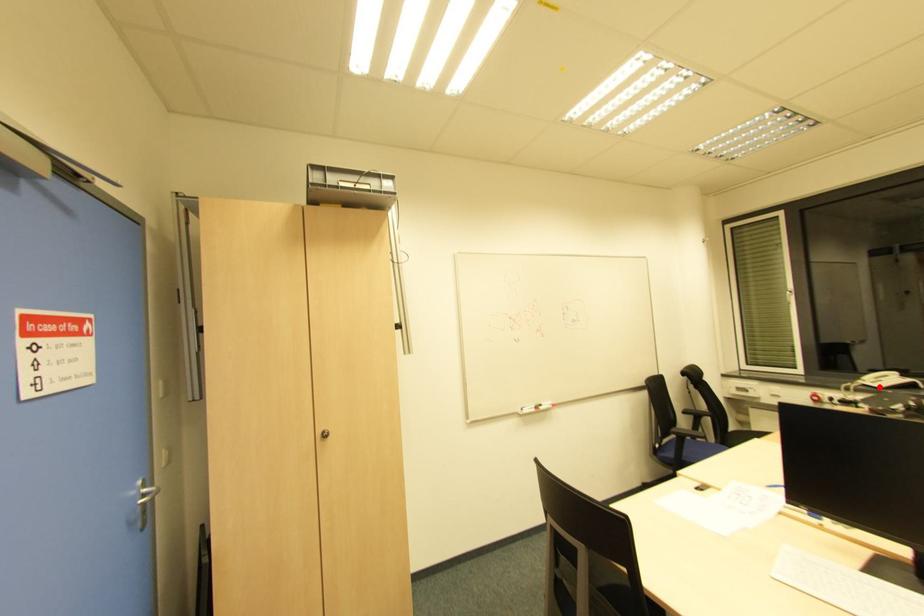
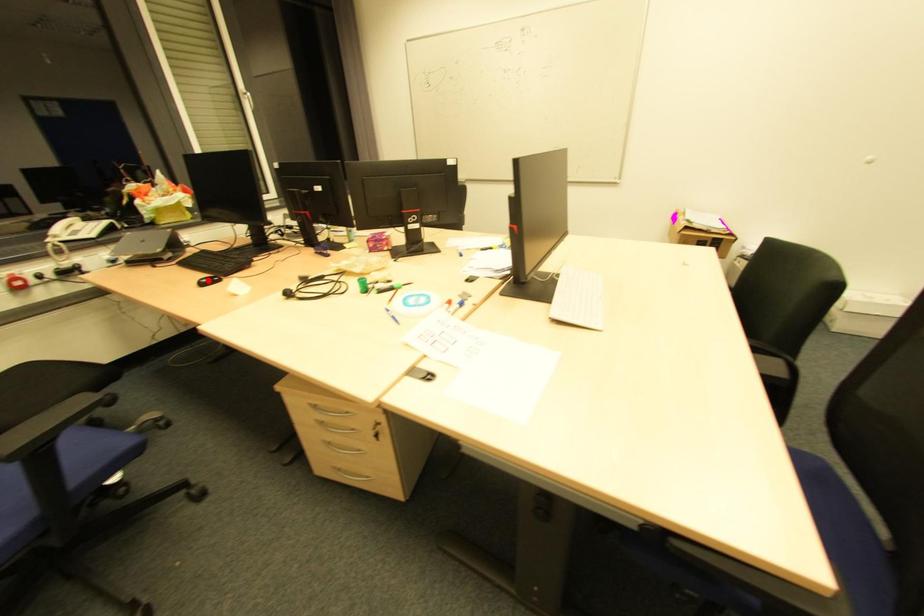
I am providing you with two images of the same scene from different viewpoints. A red point is marked on the first image and another point is marked on the second image. Are the points marked in image1 and image2 representing the same 3D position?

No